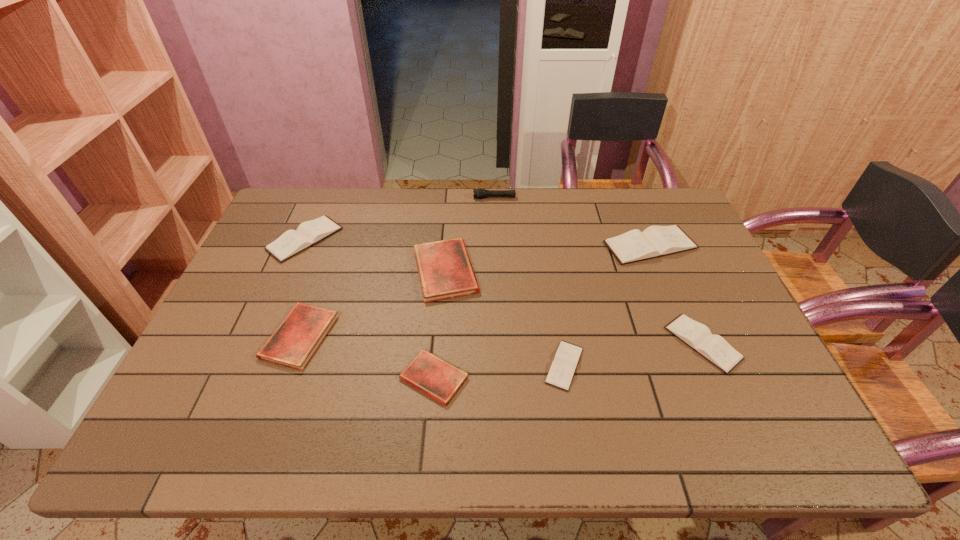
I want to click on vacant point located 0.080m at the lens end of the flashlight, so click(x=451, y=198).

Where is `free location located 0.240m at the lens end of the flashlight`? This screenshot has height=540, width=960. free location located 0.240m at the lens end of the flashlight is located at coordinates (406, 198).

Find the location of `vacant position located 0.180m on the back of the biggest brown diary`. vacant position located 0.180m on the back of the biggest brown diary is located at coordinates (630, 195).

Locate an element on the screen. This screenshot has width=960, height=540. free region located on the front of the leftmost brown diary is located at coordinates (259, 345).

You are a GUI agent. You are given a task and a screenshot of the screen. Output one action in this format:
    pyautogui.click(x=<x>, y=<y>)
    Task: Click on the free location located 0.200m on the front of the farthest red diary
    The width and height of the screenshot is (960, 540).
    Given the screenshot: What is the action you would take?
    pyautogui.click(x=438, y=365)

This screenshot has width=960, height=540. In order to click on vacant space located on the left of the second smallest brown diary in this screenshot , I will do `click(519, 343)`.

Where is `free point located 0.110m on the left of the second biggest red diary`? The image size is (960, 540). free point located 0.110m on the left of the second biggest red diary is located at coordinates (224, 336).

The width and height of the screenshot is (960, 540). Find the location of `free space located on the left of the third object from right to left`. free space located on the left of the third object from right to left is located at coordinates (419, 366).

Where is `free space located 0.320m on the back of the smallest red diary`? The height and width of the screenshot is (540, 960). free space located 0.320m on the back of the smallest red diary is located at coordinates (444, 264).

Where is `flashlight that is at the far edge`? The width and height of the screenshot is (960, 540). flashlight that is at the far edge is located at coordinates (479, 193).